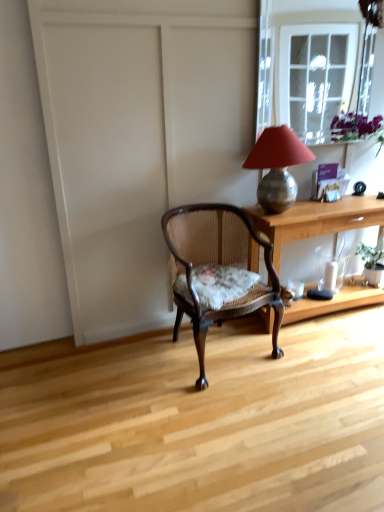
Question: Which direction should I rotate to look at wooden cane chair with floral cushion at center?

Choices:
 (A) left
 (B) right

Answer: (B)

Question: Is green leafy plant at right oriented away from clear glass window at upper right?

Choices:
 (A) no
 (B) yes

Answer: (A)

Question: Are green leafy plant at right and clear glass window at upper right beside each other?

Choices:
 (A) no
 (B) yes

Answer: (A)

Question: Is green leafy plant at right smaller than clear glass window at upper right?

Choices:
 (A) yes
 (B) no

Answer: (A)

Question: Is green leafy plant at right to the right of clear glass window at upper right from the viewer's perspective?

Choices:
 (A) yes
 (B) no

Answer: (A)

Question: Is green leafy plant at right aimed at clear glass window at upper right?

Choices:
 (A) yes
 (B) no

Answer: (B)

Question: Is the position of green leafy plant at right more distant than that of clear glass window at upper right?

Choices:
 (A) yes
 (B) no

Answer: (A)

Question: Is clear glass window at upper right completely or partially outside of wooden desk at center?

Choices:
 (A) no
 (B) yes

Answer: (B)

Question: From the image's perspective, is clear glass window at upper right located beneath wooden desk at center?

Choices:
 (A) yes
 (B) no

Answer: (B)

Question: Are clear glass window at upper right and wooden desk at center located far from each other?

Choices:
 (A) yes
 (B) no

Answer: (A)

Question: Considering the relative sizes of clear glass window at upper right and wooden desk at center in the image provided, is clear glass window at upper right wider than wooden desk at center?

Choices:
 (A) no
 (B) yes

Answer: (A)

Question: From a real-world perspective, is clear glass window at upper right located higher than wooden desk at center?

Choices:
 (A) no
 (B) yes

Answer: (B)

Question: Considering the relative sizes of clear glass window at upper right and wooden desk at center in the image provided, is clear glass window at upper right thinner than wooden desk at center?

Choices:
 (A) no
 (B) yes

Answer: (B)

Question: Is wooden desk at center positioned in front of green leafy plant at right?

Choices:
 (A) no
 (B) yes

Answer: (B)